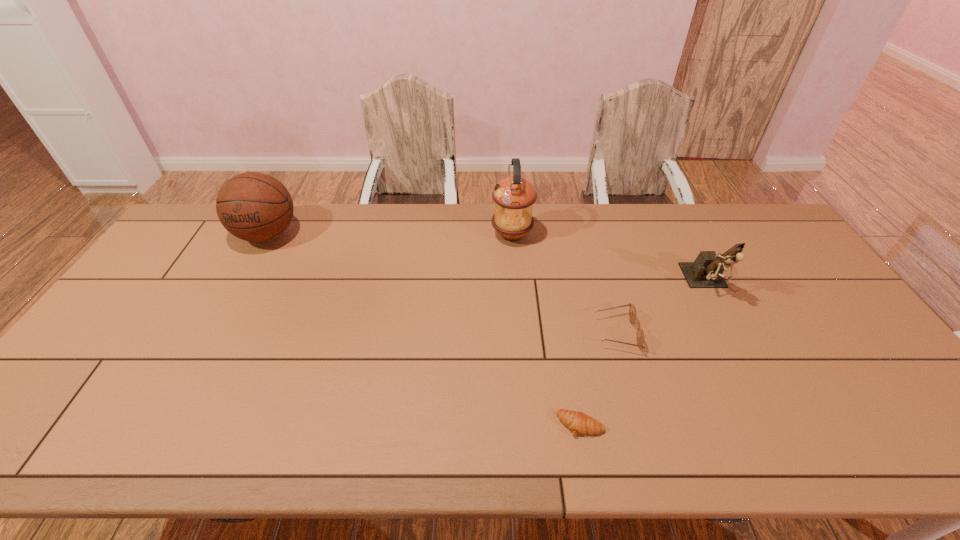
Identify the location of vacant space situated on the front-facing side of the figurine. (762, 391).

Locate an element on the screen. This screenshot has width=960, height=540. vacant space located 0.400m on the front-facing side of the second object from right to left is located at coordinates (449, 333).

Where is `vacant space situated 0.300m on the front-facing side of the second object from right to left`? The height and width of the screenshot is (540, 960). vacant space situated 0.300m on the front-facing side of the second object from right to left is located at coordinates (486, 333).

The height and width of the screenshot is (540, 960). Find the location of `vacant space located 0.240m on the front-facing side of the second object from right to left`. vacant space located 0.240m on the front-facing side of the second object from right to left is located at coordinates (508, 333).

Identify the location of blank space located on the right of the shortest object. (708, 424).

This screenshot has width=960, height=540. Identify the location of oil lamp located in the far edge section of the desktop. (514, 196).

Identify the location of basketball that is at the far edge. (256, 207).

I want to click on object present at the near edge, so click(578, 422).

This screenshot has height=540, width=960. I want to click on free space at the far edge, so click(639, 234).

You are a GUI agent. You are given a task and a screenshot of the screen. Output one action in this format:
    pyautogui.click(x=<x>, y=<y>)
    Task: Click on the vacant region at the near edge of the desktop
    This screenshot has width=960, height=540.
    Given the screenshot: What is the action you would take?
    click(x=197, y=431)